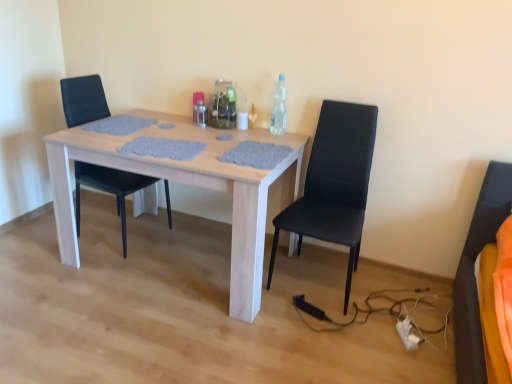
At what (x,y) coordinates should I click in order to perform the action: click on vacant area that is in front of white fabric extension cord at lower right. Please return your answer as a coordinate pair (x, y). The height and width of the screenshot is (384, 512). Looking at the image, I should click on (416, 365).